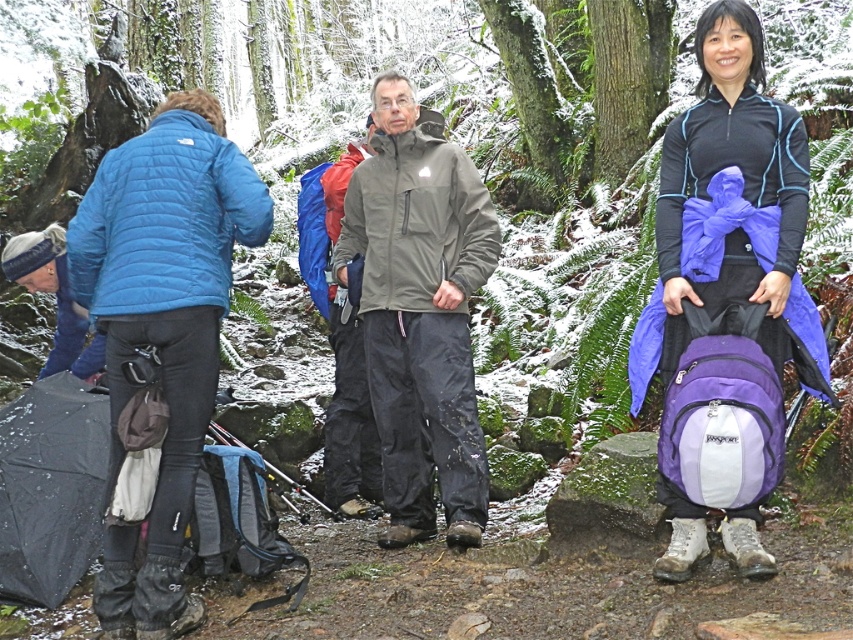
Question: Can you confirm if matte purple backpack at center is positioned to the right of gray softshell jacket at center?

Choices:
 (A) no
 (B) yes

Answer: (B)

Question: Estimate the real-world distances between objects in this image. Which object is farther from the matte blue jacket at left?

Choices:
 (A) gray softshell jacket at center
 (B) matte purple backpack at center

Answer: (B)

Question: Is matte purple backpack at center further to the viewer compared to gray softshell jacket at center?

Choices:
 (A) yes
 (B) no

Answer: (B)

Question: Among these points, which one is farthest from the camera?

Choices:
 (A) (199, 452)
 (B) (747, 317)

Answer: (A)

Question: Is matte purple backpack at center positioned behind gray softshell jacket at center?

Choices:
 (A) yes
 (B) no

Answer: (B)

Question: Which object is the farthest from the matte purple backpack at center?

Choices:
 (A) gray softshell jacket at center
 (B) matte blue jacket at left

Answer: (B)